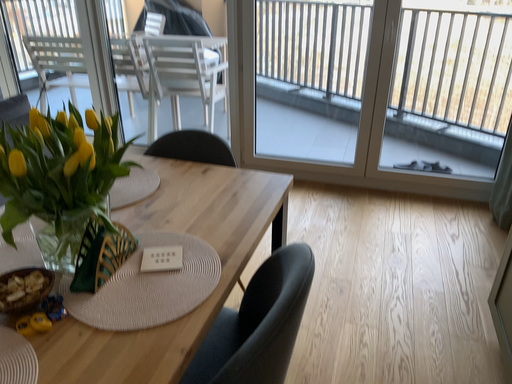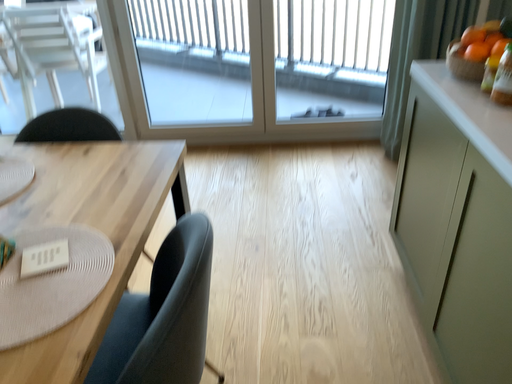
Question: Which way did the camera rotate in the video?

Choices:
 (A) rotated left
 (B) rotated right

Answer: (B)